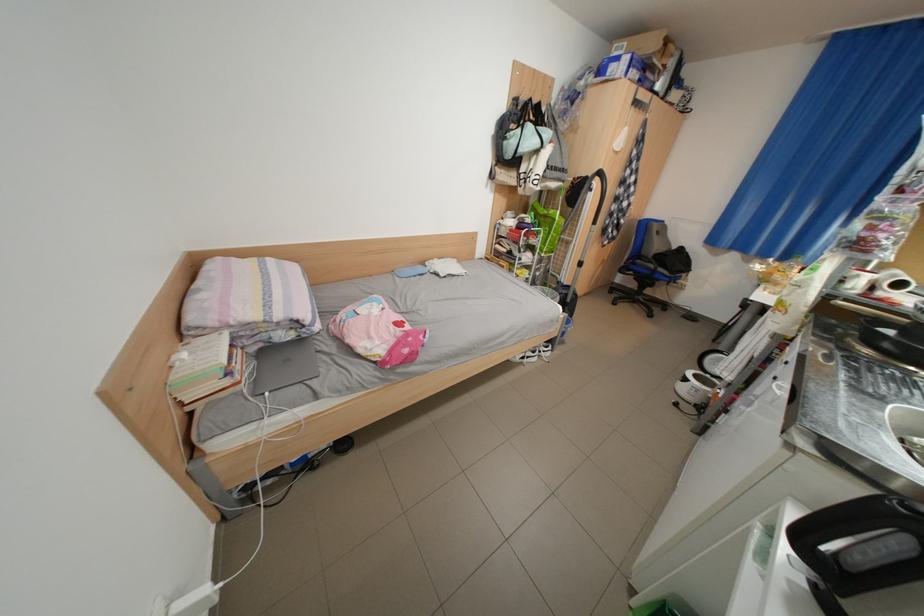
Where would you lift the light blue bag? Please return your answer as a coordinate pair (x, y).

(530, 155)